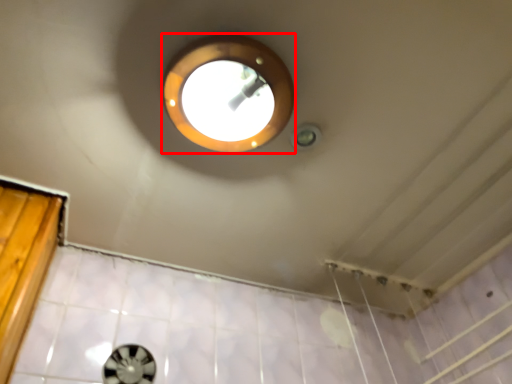
Question: Observing the image, what is the correct spatial positioning of light (annotated by the red box) in reference to porthole?

Choices:
 (A) right
 (B) left

Answer: (A)